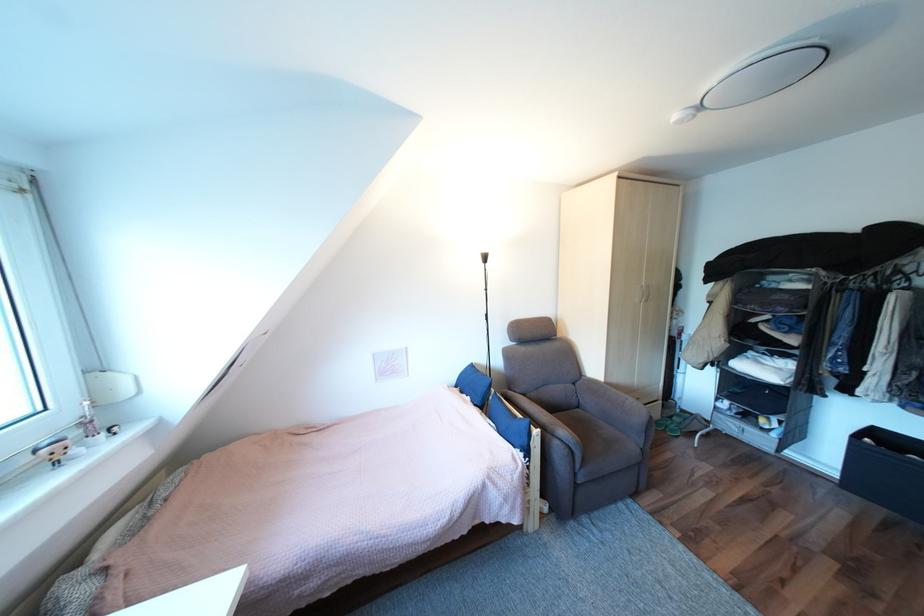
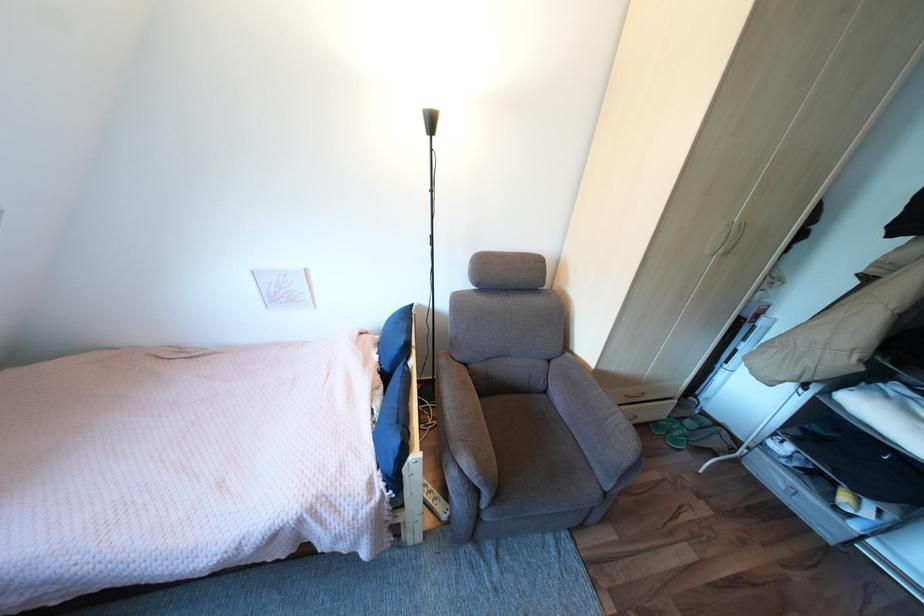
The images are taken continuously from a first-person perspective. In which direction are you moving?

The cameraman walked toward right, forward.